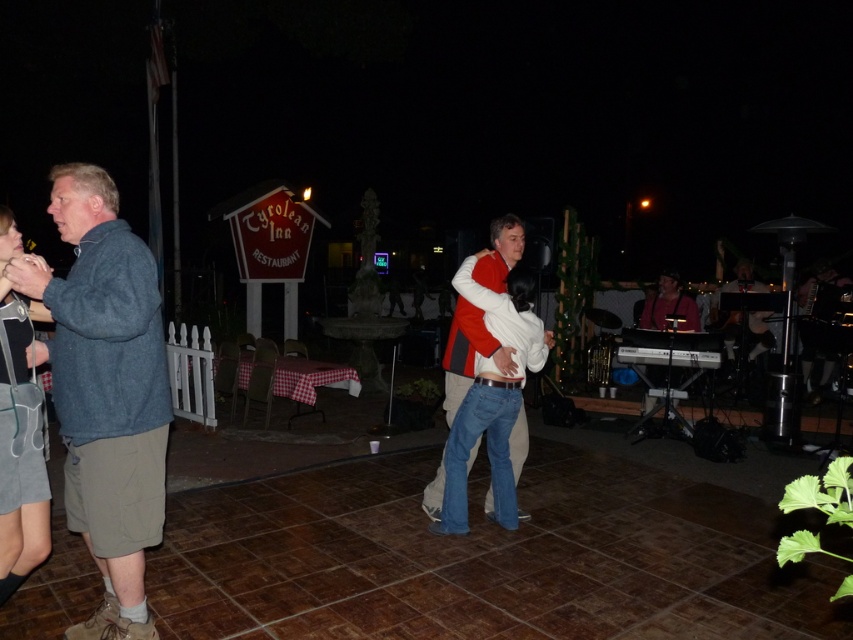
Which is above, denim jacket at left or white cotton shirt at center?

white cotton shirt at center

Is point (148, 291) in front of point (459, 301)?

Yes, it is in front of point (459, 301).

Does point (91, 273) come behind point (486, 506)?

No, (91, 273) is closer to viewer.

Where is `denim jacket at left`? This screenshot has height=640, width=853. denim jacket at left is located at coordinates (x=106, y=392).

The image size is (853, 640). What do you see at coordinates (106, 392) in the screenshot? I see `denim jacket at left` at bounding box center [106, 392].

Which is above, denim jacket at left or gray denim skirt at lower left?

denim jacket at left

I want to click on denim jacket at left, so click(106, 392).

Is gray denim skirt at lower left further to camera compared to white cotton shirt at center?

No, gray denim skirt at lower left is closer to the viewer.

The width and height of the screenshot is (853, 640). I want to click on gray denim skirt at lower left, so click(20, 513).

Between point (22, 541) and point (436, 476), which one is positioned behind?

Point (436, 476)

The height and width of the screenshot is (640, 853). Find the location of `gray denim skirt at lower left`. gray denim skirt at lower left is located at coordinates (20, 513).